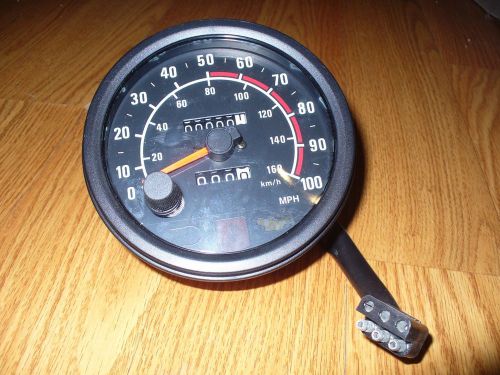
Find the location of a particular element. black handle is located at coordinates (364, 272).